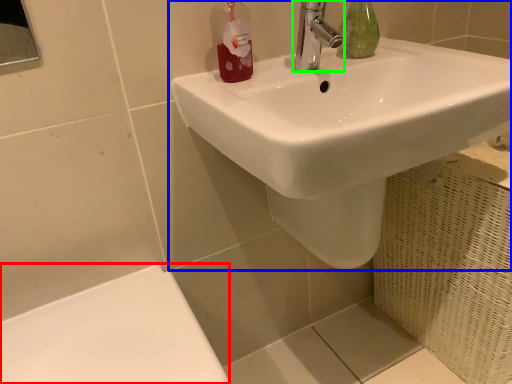
Question: Considering the real-world distances, which object is farthest from porcelain (highlighted by a red box)? sink (highlighted by a blue box) or tap (highlighted by a green box)?

Choices:
 (A) sink
 (B) tap

Answer: (B)